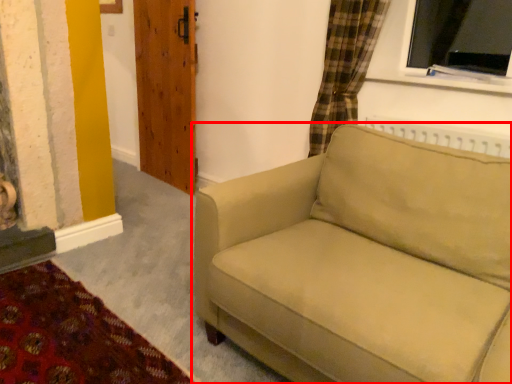
Question: Observing the image, what is the correct spatial positioning of studio couch (annotated by the red box) in reference to door?

Choices:
 (A) right
 (B) left

Answer: (A)